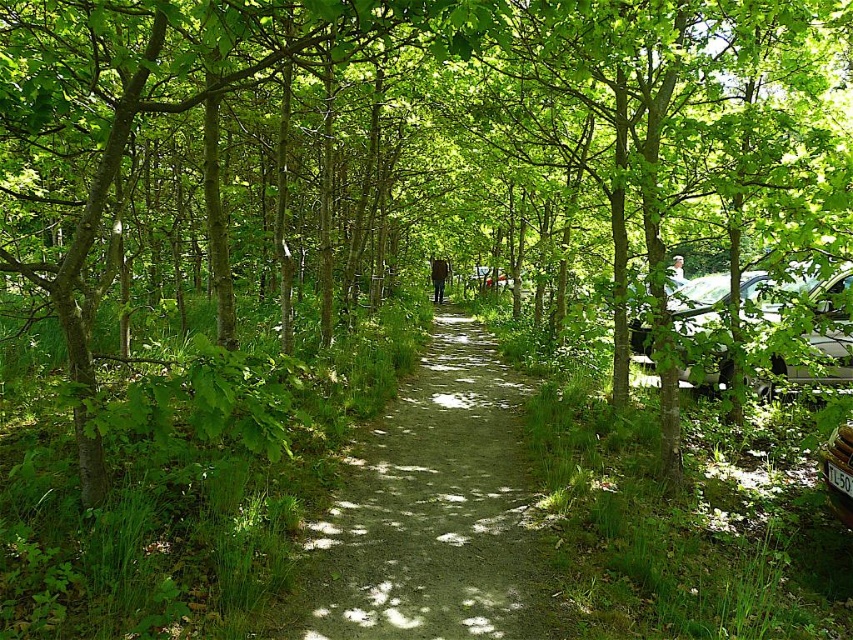
Question: Can you confirm if dirt path at center is positioned to the right of silver metallic car at right?

Choices:
 (A) no
 (B) yes

Answer: (A)

Question: Can you confirm if dirt path at center is positioned above silver metallic car at right?

Choices:
 (A) no
 (B) yes

Answer: (A)

Question: Among these objects, which one is nearest to the camera?

Choices:
 (A) dirt path at center
 (B) silver metallic car at right

Answer: (A)

Question: Does dirt path at center appear on the right side of metallic silver car at right?

Choices:
 (A) yes
 (B) no

Answer: (B)

Question: Among these objects, which one is farthest from the camera?

Choices:
 (A) silver metallic car at right
 (B) metallic silver car at right
 (C) dirt path at center

Answer: (A)

Question: Which of the following is the closest to the observer?

Choices:
 (A) silver metallic car at right
 (B) metallic silver car at right
 (C) dirt path at center

Answer: (C)